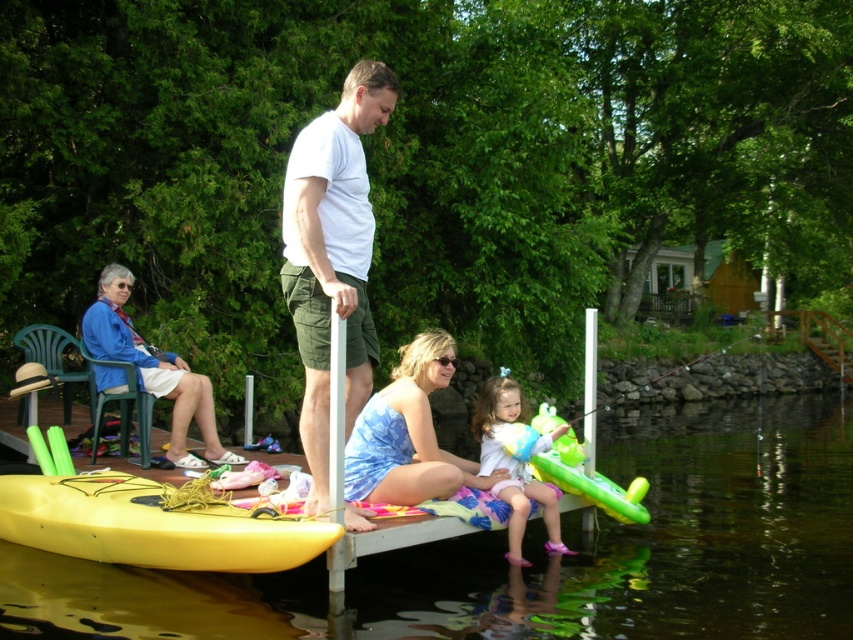
Does point (480, 486) come in front of point (144, 378)?

Yes.

The height and width of the screenshot is (640, 853). Find the location of `blue tie-dye dress at center`. blue tie-dye dress at center is located at coordinates (407, 433).

Between white matte shirt at center and white fabric dress at lower center, which one has less height?

Standing shorter between the two is white fabric dress at lower center.

The height and width of the screenshot is (640, 853). Describe the element at coordinates (332, 256) in the screenshot. I see `white matte shirt at center` at that location.

Is point (294, 154) behind point (553, 508)?

That is False.

I want to click on white matte shirt at center, so click(x=332, y=256).

Which is in front, point (817, 420) or point (202, 401)?

Point (202, 401) is in front.

Is point (709, 452) behind point (119, 316)?

Yes, it is behind point (119, 316).

Between point (33, 628) and point (183, 378), which one is positioned behind?

Point (183, 378)

What are the coordinates of `transparent plastic water at lower center` in the screenshot? It's located at (659, 540).